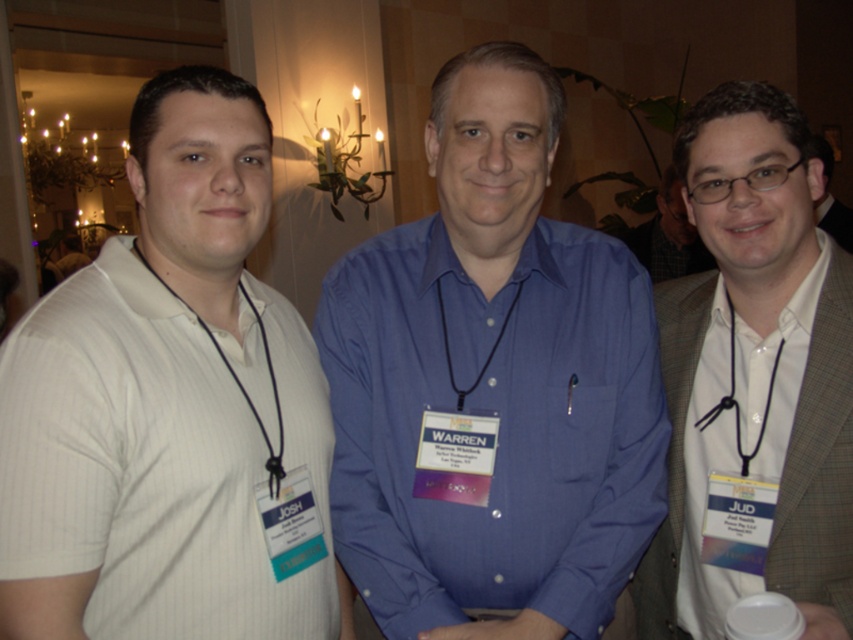
Question: Can you confirm if matte brown suit at right is thinner than matte black glasses at center?

Choices:
 (A) no
 (B) yes

Answer: (B)

Question: Which object is closer to the camera taking this photo?

Choices:
 (A) matte black glasses at center
 (B) blue shirt at center
 (C) black cord stethoscope at right
 (D) matte brown suit at right

Answer: (B)

Question: Where is white pinstripe shirt at left located in relation to black cord stethoscope at center in the image?

Choices:
 (A) right
 (B) left

Answer: (B)

Question: Can you confirm if black cord stethoscope at left is bigger than black cord stethoscope at right?

Choices:
 (A) yes
 (B) no

Answer: (A)

Question: Considering the real-world distances, which object is closest to the black cord stethoscope at left?

Choices:
 (A) black cord stethoscope at center
 (B) gray checkered suit at right

Answer: (A)

Question: Among these points, which one is nearest to the camera?

Choices:
 (A) (821, 198)
 (B) (445, 426)
 (C) (645, 250)

Answer: (B)